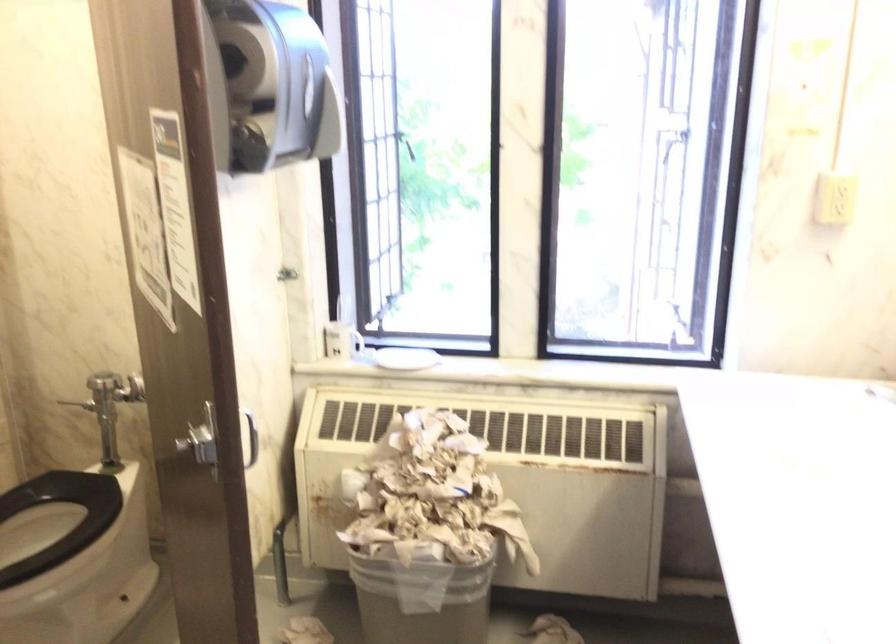
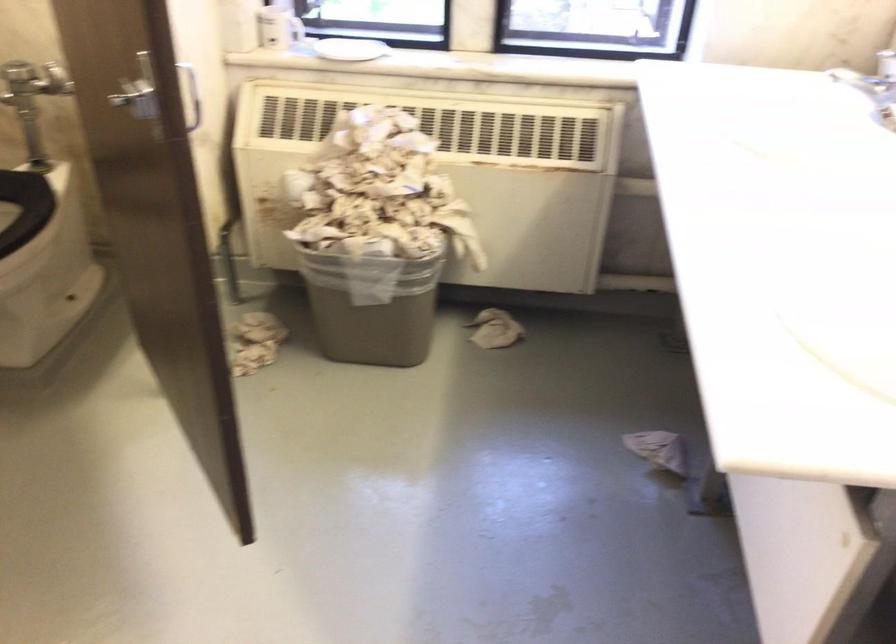
Where in the second image is the point corresponding to the point at 424,494 from the first image?

(373, 192)